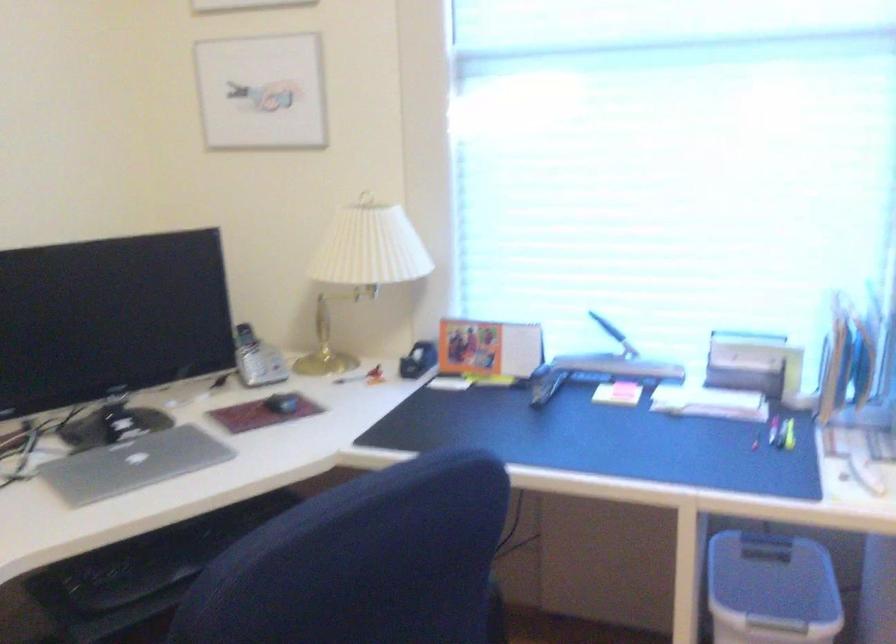
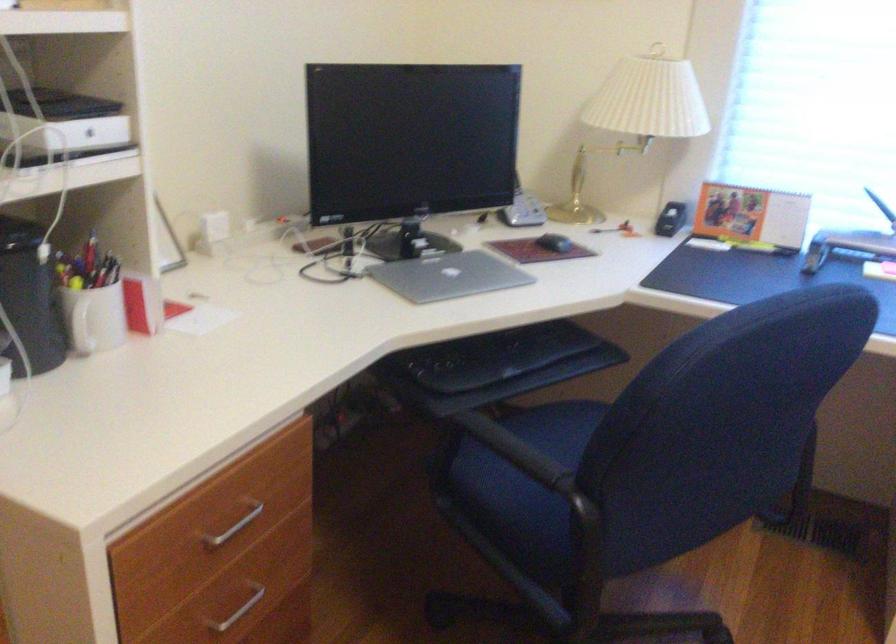
Find the pixel in the second image that matches point 278,404 in the first image.

(554, 243)